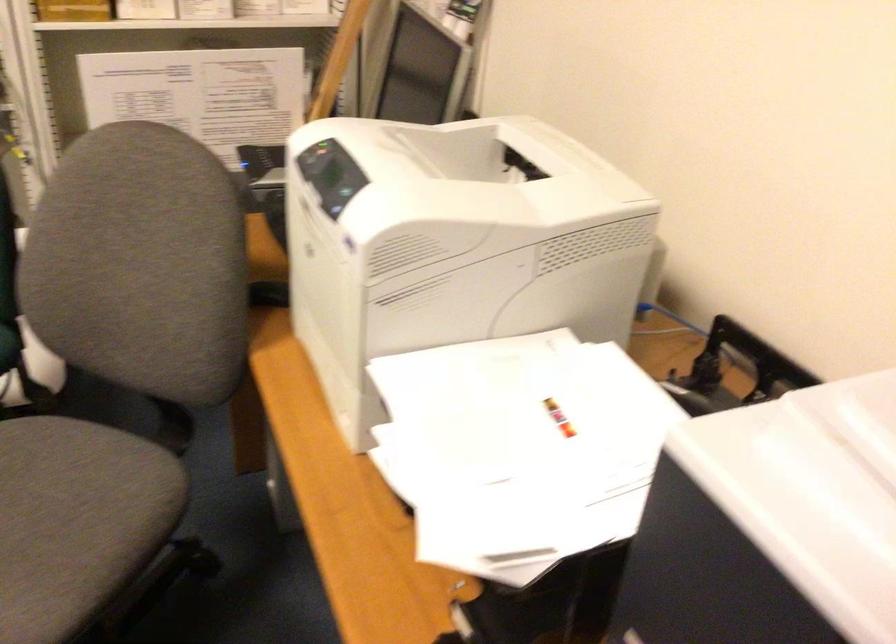
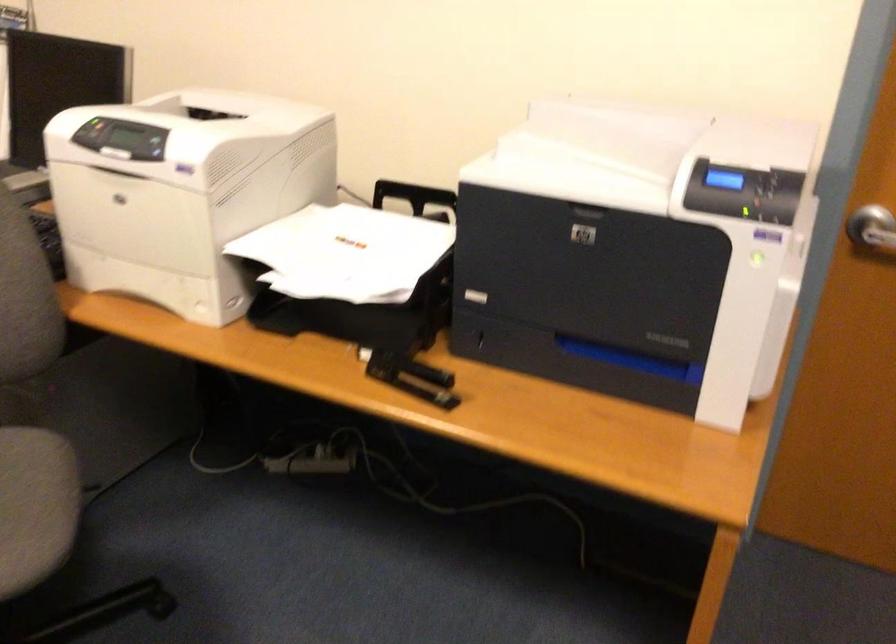
Locate, in the second image, the point that corresponds to pixel 339 196 in the first image.

(151, 144)